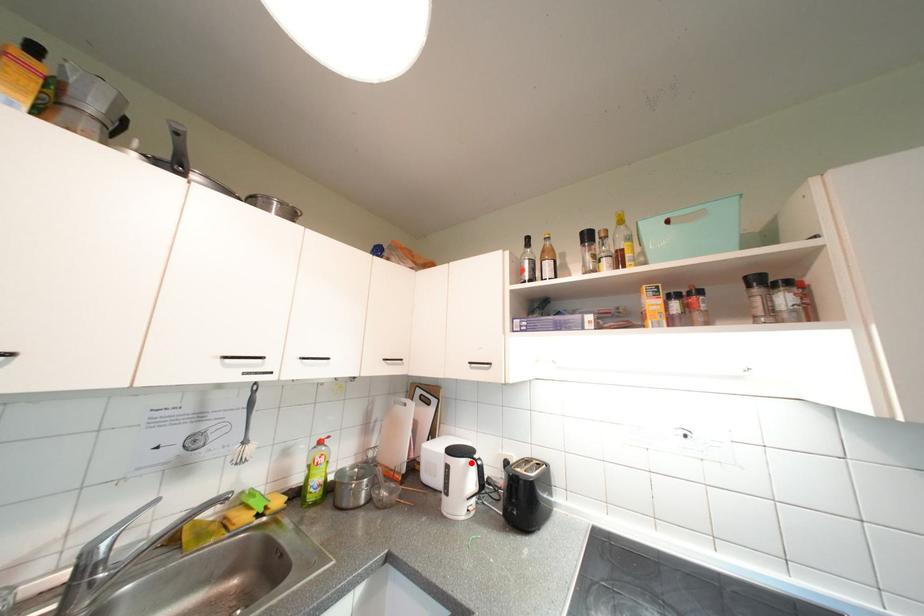
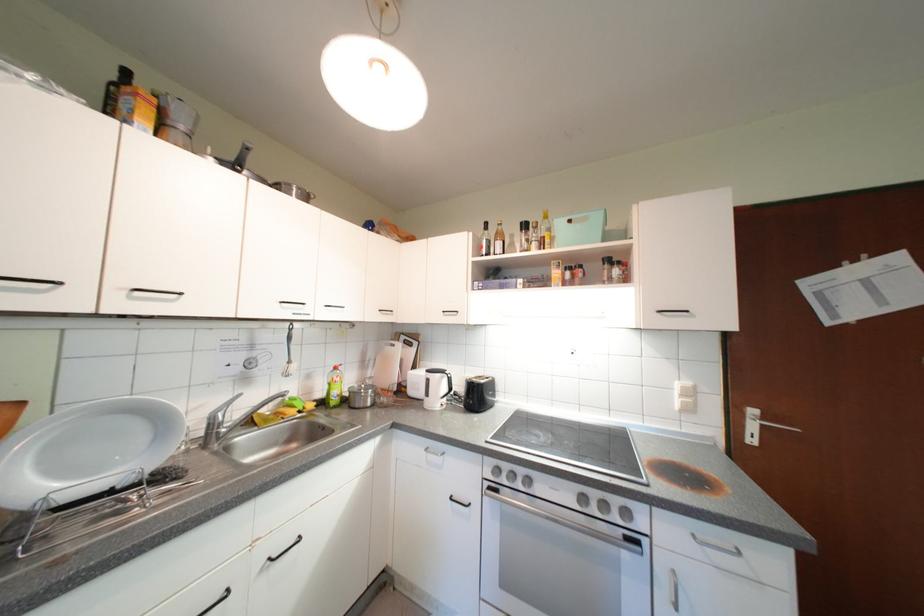
Where in the second image is the point corresponding to the highlighted location from the first image?

(446, 378)